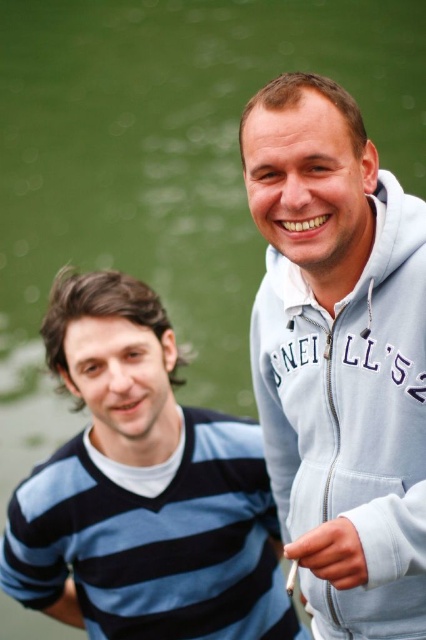
Who is lower down, light blue zip-up hoodie at upper right or blue striped sweater at left?

blue striped sweater at left

Can you confirm if light blue zip-up hoodie at upper right is positioned below blue striped sweater at left?

No, light blue zip-up hoodie at upper right is not below blue striped sweater at left.

Is point (356, 504) positioned behind point (242, 440)?

No, it is not.

The image size is (426, 640). Identify the location of light blue zip-up hoodie at upper right. (339, 356).